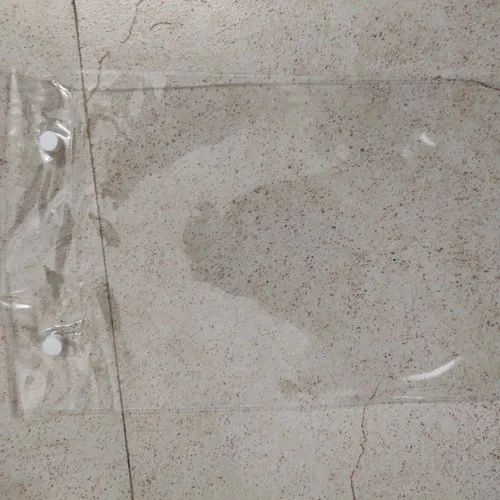
Find the location of `tile`. tile is located at coordinates (256, 474).